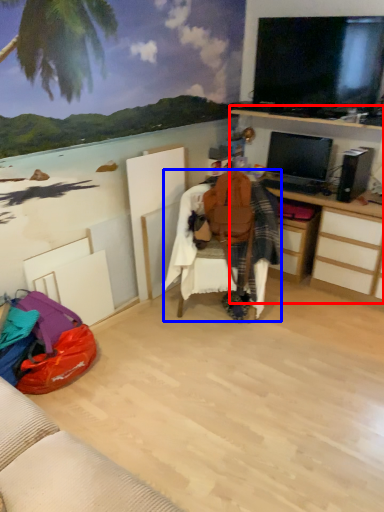
Question: Which of the following is the closest to the observer, computer desk (highlighted by a red box) or bean bag chair (highlighted by a blue box)?

Choices:
 (A) computer desk
 (B) bean bag chair

Answer: (B)